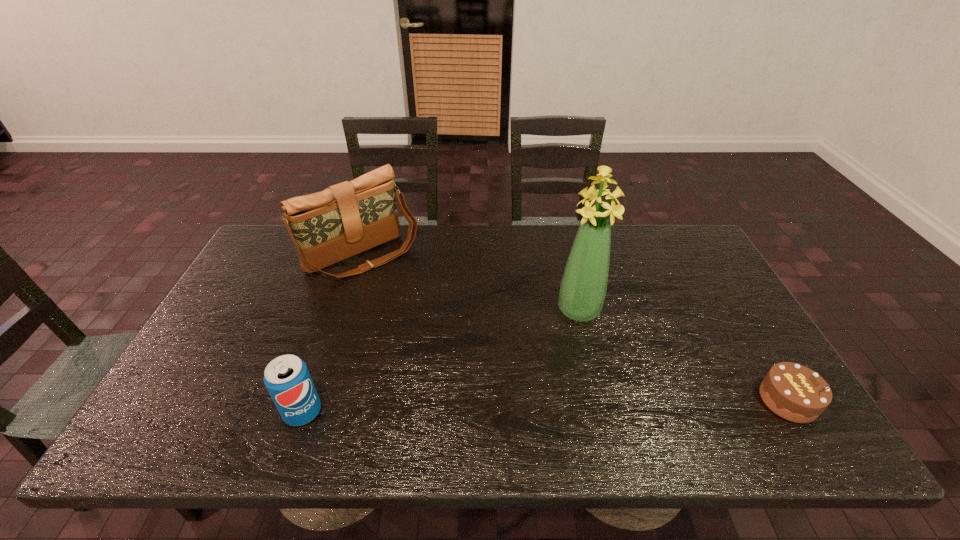
Where is `free space located on the front-facing side of the bouquet`? Image resolution: width=960 pixels, height=540 pixels. free space located on the front-facing side of the bouquet is located at coordinates (577, 340).

In order to click on vacant space situated 0.230m on the front-facing side of the bouquet in this screenshot , I will do `click(573, 397)`.

This screenshot has width=960, height=540. In order to click on vacant area situated on the front-facing side of the shoulder bag in this screenshot , I will do `click(468, 357)`.

Find the location of a particular element. The height and width of the screenshot is (540, 960). vacant space located 0.340m on the front-facing side of the shoulder bag is located at coordinates (456, 346).

Identify the location of vacant area situated 0.220m on the front-facing side of the shoulder bag. The image size is (960, 540). (431, 319).

Image resolution: width=960 pixels, height=540 pixels. Find the location of `object that is at the far edge`. object that is at the far edge is located at coordinates (348, 218).

Where is `soda can located in the near edge section of the desktop`? Image resolution: width=960 pixels, height=540 pixels. soda can located in the near edge section of the desktop is located at coordinates (287, 379).

What are the coordinates of `chocolate cake at the near edge` in the screenshot? It's located at (794, 392).

Where is `object present at the right edge`? object present at the right edge is located at coordinates (794, 392).

You are a GUI agent. You are given a task and a screenshot of the screen. Output one action in this format:
    pyautogui.click(x=<x>, y=<y>)
    Task: Click on the object present at the near right corner
    This screenshot has width=960, height=540.
    Given the screenshot: What is the action you would take?
    pyautogui.click(x=794, y=392)